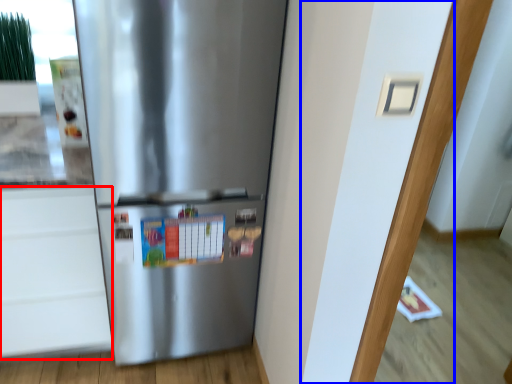
Question: Which of the following is the closest to the observer, drawer (highlighted by a red box) or door (highlighted by a blue box)?

Choices:
 (A) drawer
 (B) door

Answer: (B)